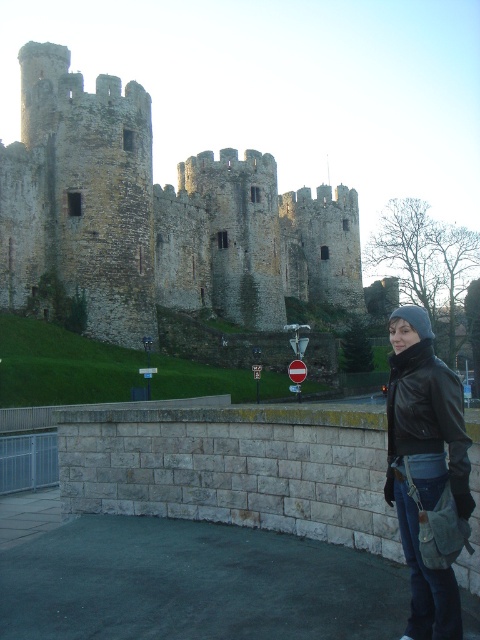
Is weathered stone castle at upper left below black leather jacket at lower right?

Incorrect, weathered stone castle at upper left is not positioned below black leather jacket at lower right.

Can you confirm if weathered stone castle at upper left is positioned to the left of black leather jacket at lower right?

Correct, you'll find weathered stone castle at upper left to the left of black leather jacket at lower right.

At what (x,y) coordinates should I click in order to perform the action: click on weathered stone castle at upper left. Please return your answer as a coordinate pair (x, y). The height and width of the screenshot is (640, 480). Looking at the image, I should click on (156, 216).